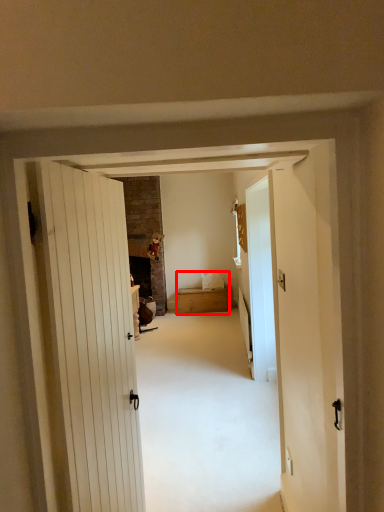
Question: In this image, where is bed (annotated by the red box) located relative to glass door?

Choices:
 (A) right
 (B) left

Answer: (B)